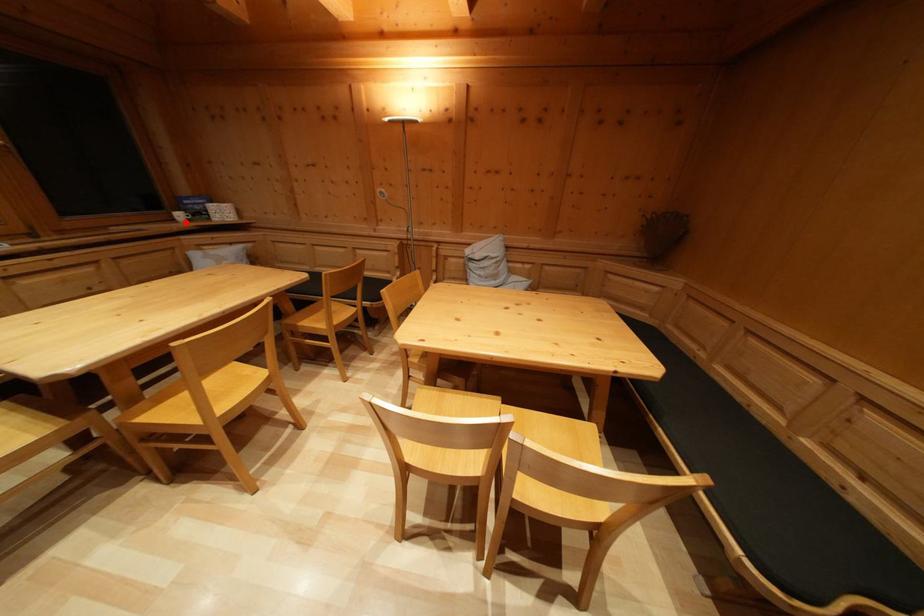
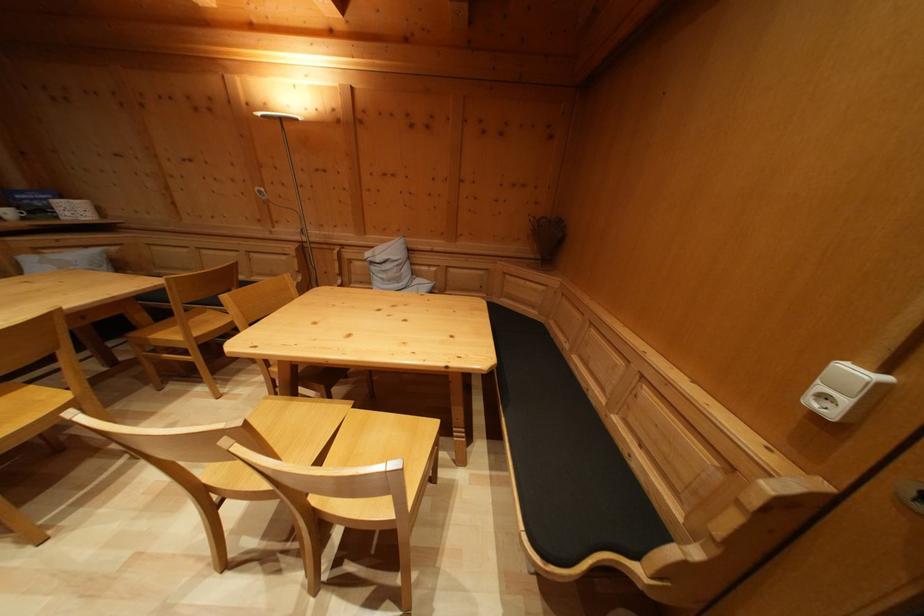
Question: I am providing you with two images of the same scene from different viewpoints. Image1 has a red point marked. In image2, the corresponding 3D location appears at what relative position? Reply with the corresponding letter.

Choices:
 (A) Closer
 (B) Farther

Answer: (B)